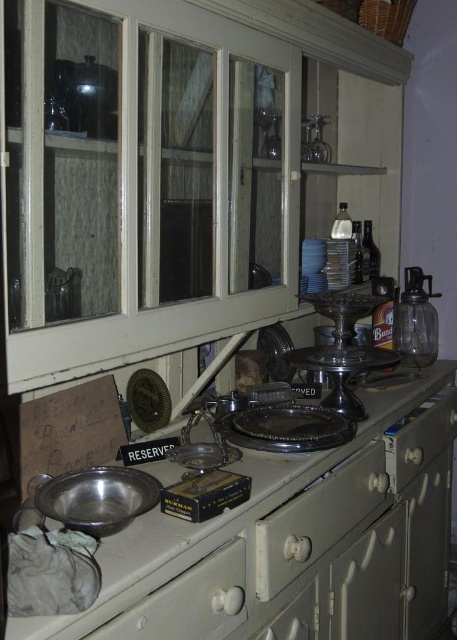
Who is positioned more to the left, white matte drawer at lower center or white painted wood drawer at right?

white matte drawer at lower center is more to the left.

Image resolution: width=457 pixels, height=640 pixels. In order to click on white matte drawer at lower center in this screenshot , I will do `click(189, 602)`.

Image resolution: width=457 pixels, height=640 pixels. I want to click on white matte drawer at lower center, so pos(189,602).

This screenshot has width=457, height=640. I want to click on white matte drawer at lower center, so click(189, 602).

From the picture: Does metallic silver tray at center come behind white painted wood drawer at center?

No, it is not.

How far apart are metallic silver tray at center and white painted wood drawer at center?

metallic silver tray at center and white painted wood drawer at center are 5.21 inches apart from each other.

Does point (441, 419) come behind point (323, 486)?

Yes, it is.

I want to click on metallic silver tray at center, so click(296, 541).

Looking at this image, can you confirm if white painted wood drawer at center is thinner than white painted wood drawer at right?

Indeed, white painted wood drawer at center has a lesser width compared to white painted wood drawer at right.

Between point (377, 448) and point (419, 422), which one is positioned behind?

Positioned behind is point (419, 422).

Identify the location of white painted wood drawer at center. The height and width of the screenshot is (640, 457). (318, 518).